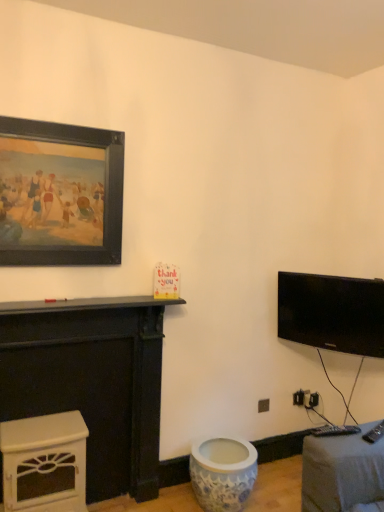
Describe the element at coordinates (332, 312) in the screenshot. I see `black glossy tv at upper right` at that location.

What do you see at coordinates (91, 381) in the screenshot? The image size is (384, 512). I see `white painted wood fireplace at left, the first furniture from the top` at bounding box center [91, 381].

Where is `black matte picture frame at upper left`? This screenshot has height=512, width=384. black matte picture frame at upper left is located at coordinates (60, 194).

Could you tell me if white glossy fireplace at lower left, which is counted as the 1th furniture, starting from the bottom, is facing blue porcelain vase at lower center?

No, white glossy fireplace at lower left, which is counted as the 1th furniture, starting from the bottom, is not facing towards blue porcelain vase at lower center.

Is white glossy fireplace at lower left, which is counted as the 1th furniture, starting from the bottom, taller than blue porcelain vase at lower center?

Yes.

Would you say white glossy fireplace at lower left, which is counted as the 1th furniture, starting from the bottom, is to the left or to the right of blue porcelain vase at lower center in the picture?

white glossy fireplace at lower left, which is counted as the 1th furniture, starting from the bottom, is positioned on blue porcelain vase at lower center's left side.

From the image's perspective, is white glossy fireplace at lower left, which is counted as the 1th furniture, starting from the bottom, above blue porcelain vase at lower center?

Yes, from the image's perspective, white glossy fireplace at lower left, which is counted as the 1th furniture, starting from the bottom, is above blue porcelain vase at lower center.

Does white glossy fireplace at lower left, which is counted as the 1th furniture, starting from the bottom, turn towards black matte picture frame at upper left?

No, white glossy fireplace at lower left, which is counted as the 1th furniture, starting from the bottom, is not oriented towards black matte picture frame at upper left.

Considering the positions of point (75, 432) and point (90, 186), is point (75, 432) closer or farther from the camera than point (90, 186)?

Point (75, 432) is positioned closer to the camera compared to point (90, 186).

Can you confirm if white glossy fireplace at lower left, which is counted as the 2th furniture, starting from the top, is thinner than black matte picture frame at upper left?

No.

From a real-world perspective, is white glossy fireplace at lower left, which is counted as the 1th furniture, starting from the bottom, on top of black matte picture frame at upper left?

No, from a real-world perspective, white glossy fireplace at lower left, which is counted as the 1th furniture, starting from the bottom, is not on top of black matte picture frame at upper left.

Who is smaller, blue porcelain vase at lower center or black matte picture frame at upper left?

black matte picture frame at upper left.

Is blue porcelain vase at lower center positioned far away from black matte picture frame at upper left?

Yes, blue porcelain vase at lower center is far from black matte picture frame at upper left.

In the scene shown: Would you say blue porcelain vase at lower center is outside black matte picture frame at upper left?

Absolutely, blue porcelain vase at lower center is external to black matte picture frame at upper left.

From the image's perspective, is blue porcelain vase at lower center beneath black matte picture frame at upper left?

Yes, from the image's perspective, blue porcelain vase at lower center is below black matte picture frame at upper left.

Consider the image. Do you think black matte picture frame at upper left is within white glossy fireplace at lower left, which is counted as the 1th furniture, starting from the bottom, or outside of it?

black matte picture frame at upper left exists outside the volume of white glossy fireplace at lower left, which is counted as the 1th furniture, starting from the bottom.

Can you confirm if black matte picture frame at upper left is wider than white glossy fireplace at lower left, which is counted as the 2th furniture, starting from the top?

No, black matte picture frame at upper left is not wider than white glossy fireplace at lower left, which is counted as the 2th furniture, starting from the top.

From the image's perspective, which is above, black matte picture frame at upper left or white glossy fireplace at lower left, which is counted as the 1th furniture, starting from the bottom?

black matte picture frame at upper left, from the image's perspective.

Does black matte picture frame at upper left have a larger size compared to white glossy fireplace at lower left, which is counted as the 1th furniture, starting from the bottom?

No, black matte picture frame at upper left is not bigger than white glossy fireplace at lower left, which is counted as the 1th furniture, starting from the bottom.

Find the location of a particular element. furniture above the white glossy fireplace at lower left, which is counted as the 2th furniture, starting from the top (from a real-world perspective) is located at coordinates (91, 381).

In the scene shown: Is white painted wood fireplace at left, the first furniture from the top, looking in the opposite direction of white glossy fireplace at lower left, which is counted as the 2th furniture, starting from the top?

Yes, white painted wood fireplace at left, the first furniture from the top,'s orientation is away from white glossy fireplace at lower left, which is counted as the 2th furniture, starting from the top.

Between white painted wood fireplace at left, the 2th furniture ordered from the bottom, and white glossy fireplace at lower left, which is counted as the 1th furniture, starting from the bottom, which one appears on the right side from the viewer's perspective?

white painted wood fireplace at left, the 2th furniture ordered from the bottom, is more to the right.

Which object is wider, white painted wood fireplace at left, the first furniture from the top, or white glossy fireplace at lower left, which is counted as the 1th furniture, starting from the bottom?

white glossy fireplace at lower left, which is counted as the 1th furniture, starting from the bottom.

Is black matte picture frame at upper left not close to blue porcelain vase at lower center?

Yes, black matte picture frame at upper left and blue porcelain vase at lower center are located far from each other.

Does point (61, 197) come in front of point (199, 488)?

Yes, it is in front of point (199, 488).

Is black matte picture frame at upper left bigger than blue porcelain vase at lower center?

Actually, black matte picture frame at upper left might be smaller than blue porcelain vase at lower center.

Can you confirm if black matte picture frame at upper left is positioned to the right of blue porcelain vase at lower center?

In fact, black matte picture frame at upper left is to the left of blue porcelain vase at lower center.

Considering the positions of objects black matte picture frame at upper left and black glossy tv at upper right in the image provided, who is behind, black matte picture frame at upper left or black glossy tv at upper right?

Positioned behind is black glossy tv at upper right.

Is black matte picture frame at upper left not close to black glossy tv at upper right?

Indeed, black matte picture frame at upper left is not near black glossy tv at upper right.

Can black glossy tv at upper right be found inside black matte picture frame at upper left?

No, black glossy tv at upper right is not surrounded by black matte picture frame at upper left.

Is black matte picture frame at upper left shorter than black glossy tv at upper right?

No.

Where is `toilet that appears behind the white glossy fireplace at lower left, which is counted as the 2th furniture, starting from the top`? toilet that appears behind the white glossy fireplace at lower left, which is counted as the 2th furniture, starting from the top is located at coordinates (222, 472).

The width and height of the screenshot is (384, 512). In order to click on picture frame on the right of the white glossy fireplace at lower left, which is counted as the 1th furniture, starting from the bottom in this screenshot , I will do `click(60, 194)`.

From the picture: Considering their positions, is black matte picture frame at upper left positioned further to black glossy tv at upper right than white glossy fireplace at lower left, which is counted as the 2th furniture, starting from the top?

white glossy fireplace at lower left, which is counted as the 2th furniture, starting from the top, is positioned further to the anchor black glossy tv at upper right.

From the image, which object appears to be farther from black glossy tv at upper right, white painted wood fireplace at left, the 2th furniture ordered from the bottom, or black matte picture frame at upper left?

black matte picture frame at upper left is positioned further to the anchor black glossy tv at upper right.

Which object lies further to the anchor point black glossy tv at upper right, blue porcelain vase at lower center or white glossy fireplace at lower left, which is counted as the 1th furniture, starting from the bottom?

white glossy fireplace at lower left, which is counted as the 1th furniture, starting from the bottom, is positioned further to the anchor black glossy tv at upper right.

When comparing their distances from white painted wood fireplace at left, the first furniture from the top, does black glossy tv at upper right or blue porcelain vase at lower center seem further?

black glossy tv at upper right lies further to white painted wood fireplace at left, the first furniture from the top, than the other object.

Which object lies further to the anchor point blue porcelain vase at lower center, black matte picture frame at upper left or black glossy tv at upper right?

Based on the image, black matte picture frame at upper left appears to be further to blue porcelain vase at lower center.

Considering their positions, is white glossy fireplace at lower left, which is counted as the 1th furniture, starting from the bottom, positioned closer to black matte picture frame at upper left than blue porcelain vase at lower center?

white glossy fireplace at lower left, which is counted as the 1th furniture, starting from the bottom, is closer to black matte picture frame at upper left.

Considering their positions, is white glossy fireplace at lower left, which is counted as the 2th furniture, starting from the top, positioned further to black glossy tv at upper right than black matte picture frame at upper left?

white glossy fireplace at lower left, which is counted as the 2th furniture, starting from the top.

Which object lies nearer to the anchor point white painted wood fireplace at left, the first furniture from the top, black matte picture frame at upper left or blue porcelain vase at lower center?

The object closer to white painted wood fireplace at left, the first furniture from the top, is black matte picture frame at upper left.

This screenshot has height=512, width=384. Identify the location of furniture between black matte picture frame at upper left and white glossy fireplace at lower left, which is counted as the 1th furniture, starting from the bottom, in the up-down direction. (91, 381).

This screenshot has width=384, height=512. What are the coordinates of `toilet between white painted wood fireplace at left, the first furniture from the top, and black glossy tv at upper right, in the horizontal direction` in the screenshot? It's located at (222, 472).

Identify the location of picture frame between white glossy fireplace at lower left, which is counted as the 2th furniture, starting from the top, and black glossy tv at upper right from left to right. The width and height of the screenshot is (384, 512). (60, 194).

I want to click on television between black matte picture frame at upper left and blue porcelain vase at lower center in the vertical direction, so click(332, 312).